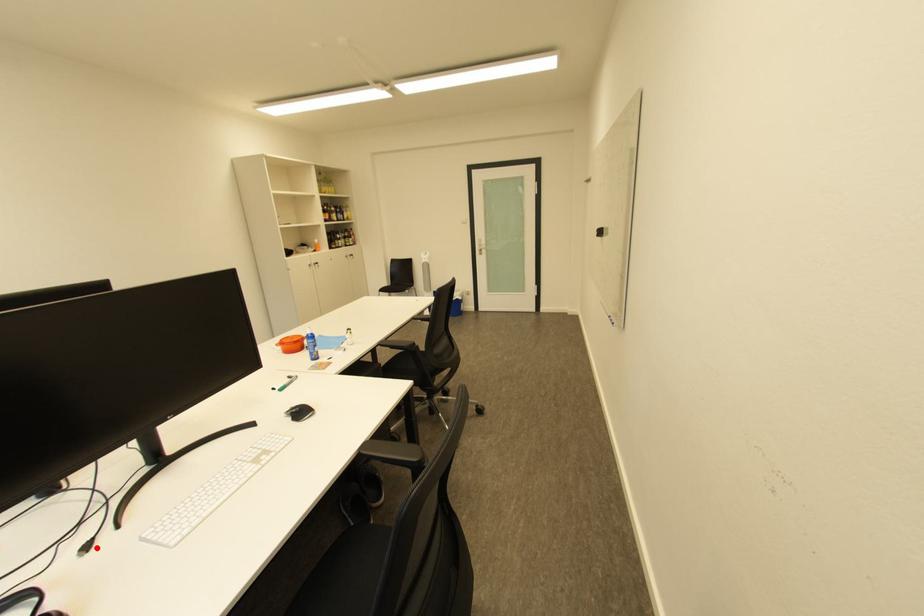
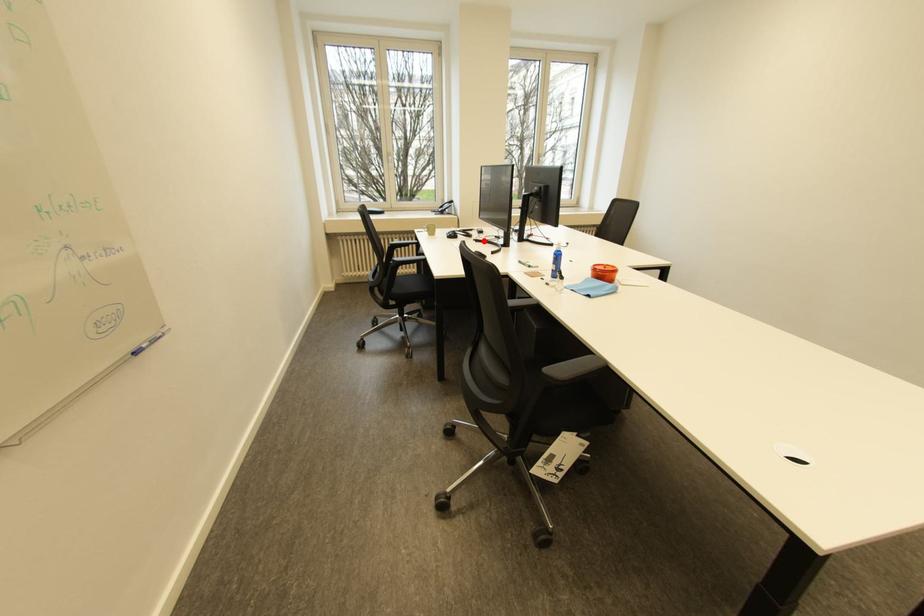
I am providing you with two images of the same scene from different viewpoints. A red point is marked on the first image and another point is marked on the second image. Is the red point in image1 aligned with the point shown in image2?

Yes